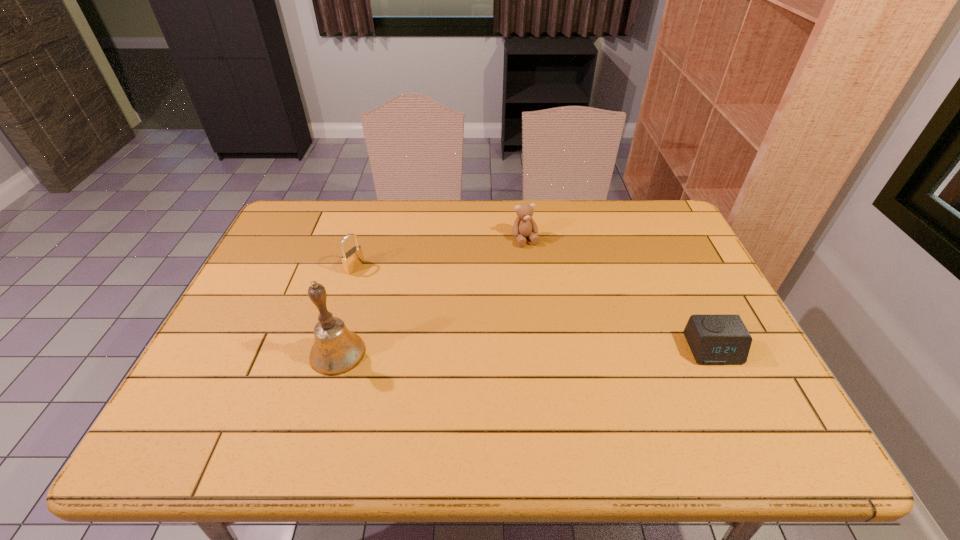
In order to click on free space located 0.280m on the face of the teddy bear in this screenshot , I will do `click(562, 312)`.

Locate an element on the screen. This screenshot has width=960, height=540. vacant space located on the front-facing side of the padlock is located at coordinates (452, 311).

Image resolution: width=960 pixels, height=540 pixels. Identify the location of free space located 0.140m on the front-facing side of the padlock. coord(398,287).

The height and width of the screenshot is (540, 960). I want to click on vacant space located on the front-facing side of the padlock, so click(388, 282).

I want to click on object present at the far edge, so click(524, 226).

You are a GUI agent. You are given a task and a screenshot of the screen. Output one action in this format:
    pyautogui.click(x=<x>, y=<y>)
    Task: Click on the object situated at the right edge
    Image resolution: width=960 pixels, height=540 pixels.
    Given the screenshot: What is the action you would take?
    pyautogui.click(x=713, y=339)

In the image, there is a desktop. Where is `free space at the far edge`? This screenshot has height=540, width=960. free space at the far edge is located at coordinates (403, 218).

Find the location of `vacant region at the near edge`. vacant region at the near edge is located at coordinates (534, 402).

You are a GUI agent. You are given a task and a screenshot of the screen. Output one action in this format:
    pyautogui.click(x=<x>, y=<y>)
    Task: Click on the vacant space at the left edge of the desktop
    This screenshot has width=960, height=540.
    Given the screenshot: What is the action you would take?
    pyautogui.click(x=208, y=361)

This screenshot has width=960, height=540. In order to click on free space at the right edge of the desktop in this screenshot , I will do `click(664, 258)`.